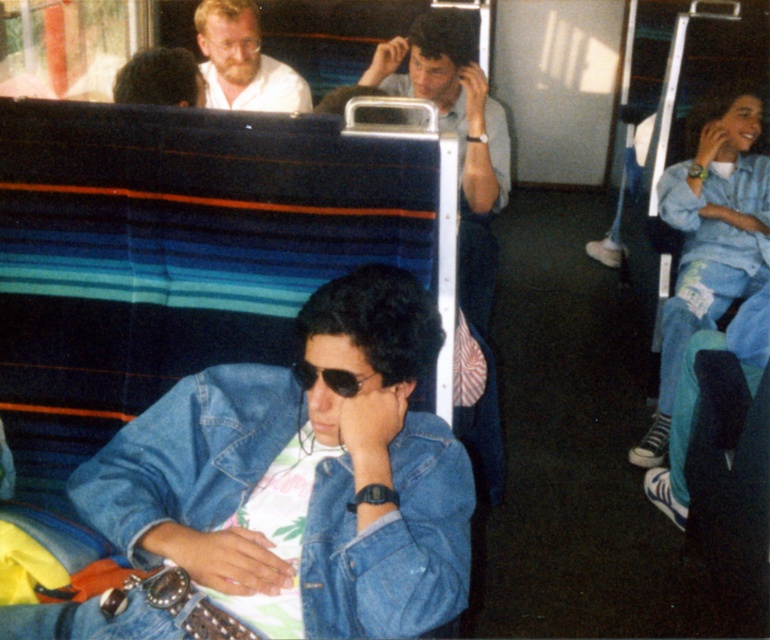
Looking at this image, you are a passenger on a train and want to ask the bearded man at upper left a question. To do so, you need to walk past the denim jacket at upper right. Is the path clear?

The denim jacket at upper right is located below the bearded man at upper left, meaning the jacket is positioned lower in the image. Since the jacket is below the man, it is likely positioned closer to you. Therefore, you would need to walk around or through the area where the denim jacket at upper right is located, which may block your path to the bearded man at upper left.

You are a passenger on a train and want to borrow a pen from the faded denim jacket at lower right. Can you reach it without leaving your seat if your arm can extend 0.8 meters?

The faded denim jacket at lower right is 1.21 meters away from you. Since your arm can only extend 0.8 meters, you cannot reach the faded denim jacket at lower right without leaving your seat.

In the scene shown: You are standing at the entrance of the train and want to find the faded denim jacket at lower right. According to the coordinate system where the bottom left corner is the origin, can you estimate whether the jacket is closer to the front or the back of the train?

The faded denim jacket at lower right is located at coordinate point 0.745 on the x axis and 0.395 on the y axis. Since the x coordinate is closer to 1, which represents the right side of the train, and the y coordinate is closer to 0.4, which is midway between the front and back, it is approximately in the middle of the train. However, since the jacket is at lower right, it might be closer to the back depending on the train length.